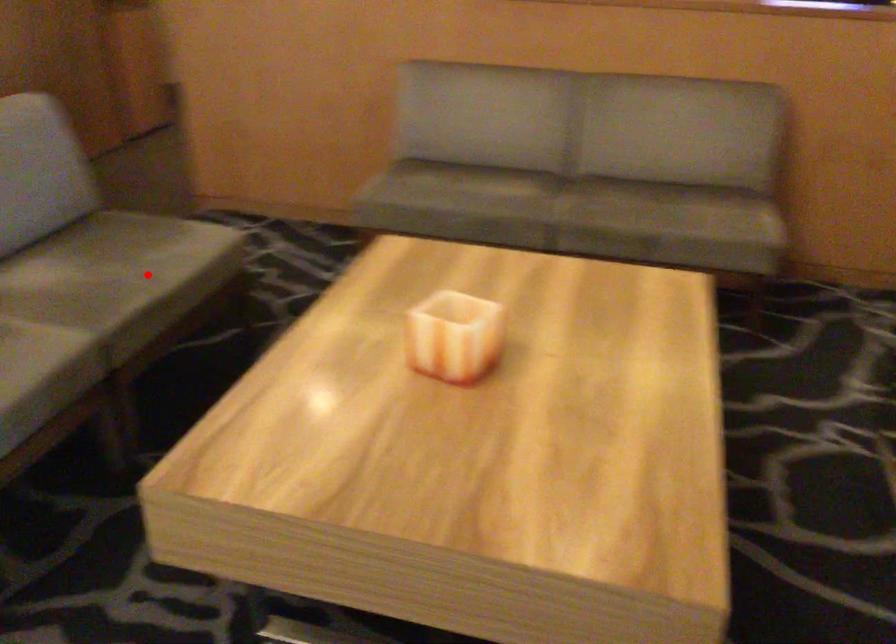
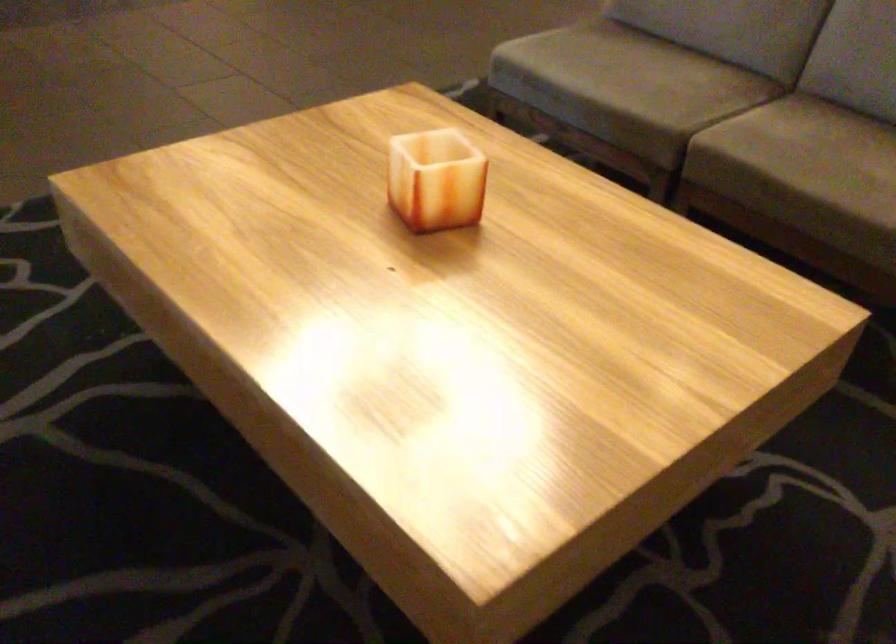
Question: I am providing you with two images of the same scene from different viewpoints. A red point is shown in image1. For the corresponding object point in image2, is it positioned nearer or farther from the camera?

Choices:
 (A) Nearer
 (B) Farther

Answer: (A)